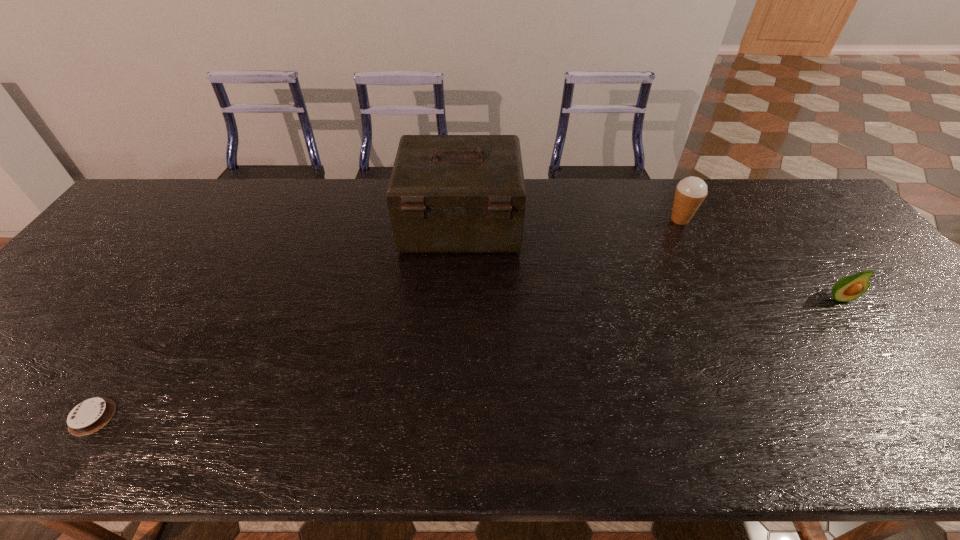
Where is `vacant space that's between the second shortest object and the leftmost object`? vacant space that's between the second shortest object and the leftmost object is located at coordinates (466, 357).

Image resolution: width=960 pixels, height=540 pixels. Find the location of `vacant area between the third object from right to left and the icecream`. vacant area between the third object from right to left and the icecream is located at coordinates (570, 221).

Find the location of a particular element. This screenshot has height=540, width=960. vacant area that lies between the third farthest object and the leftmost object is located at coordinates (466, 357).

What are the coordinates of `vacant area between the leftmost object and the first-aid kit` in the screenshot? It's located at (276, 320).

Identify the location of free space between the tallest object and the second object from right to left. Image resolution: width=960 pixels, height=540 pixels. (570, 221).

Locate an element on the screen. free space that is in between the avocado and the icecream is located at coordinates (759, 259).

Image resolution: width=960 pixels, height=540 pixels. Find the location of `vacant region between the shortest object and the third object from right to left`. vacant region between the shortest object and the third object from right to left is located at coordinates (276, 320).

Image resolution: width=960 pixels, height=540 pixels. In order to click on free space between the leftmost object and the avocado in this screenshot , I will do coord(466,357).

In order to click on vacant area between the icecream and the rightmost object in this screenshot , I will do `click(759, 259)`.

Locate an element on the screen. This screenshot has width=960, height=540. free spot between the first-aid kit and the avocado is located at coordinates (650, 261).